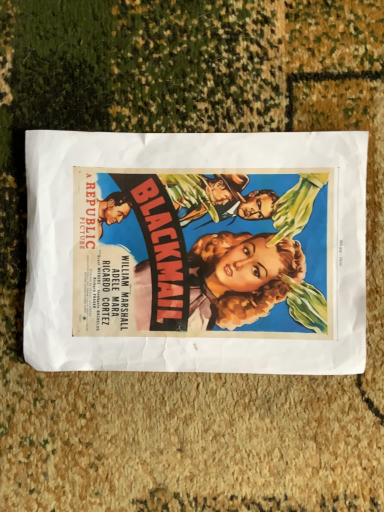
The width and height of the screenshot is (384, 512). In order to click on empty space that is ontop of matte paper poster at center (from a real-world perspective) in this screenshot , I will do `click(195, 253)`.